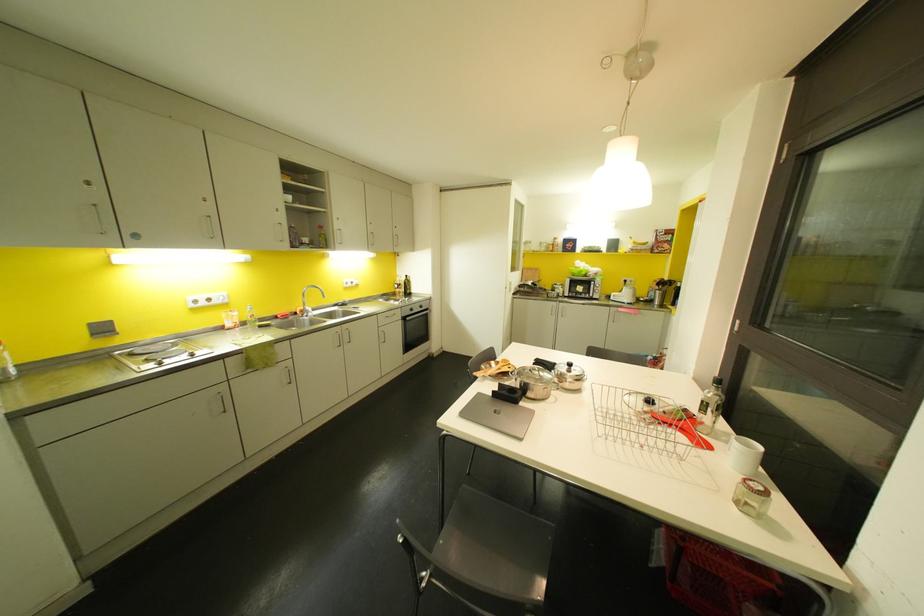
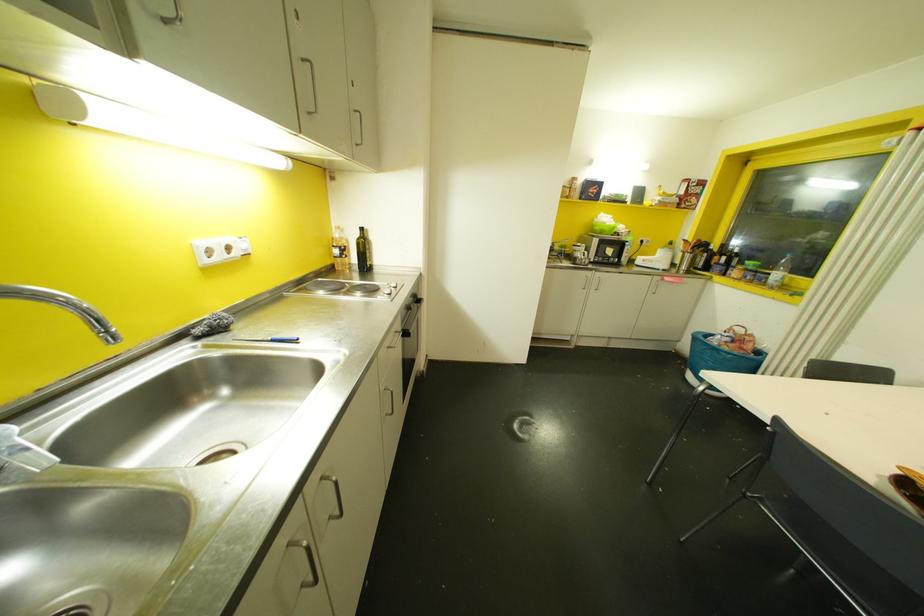
In the second image, find the point that corresponds to point (560, 313) in the first image.

(592, 286)